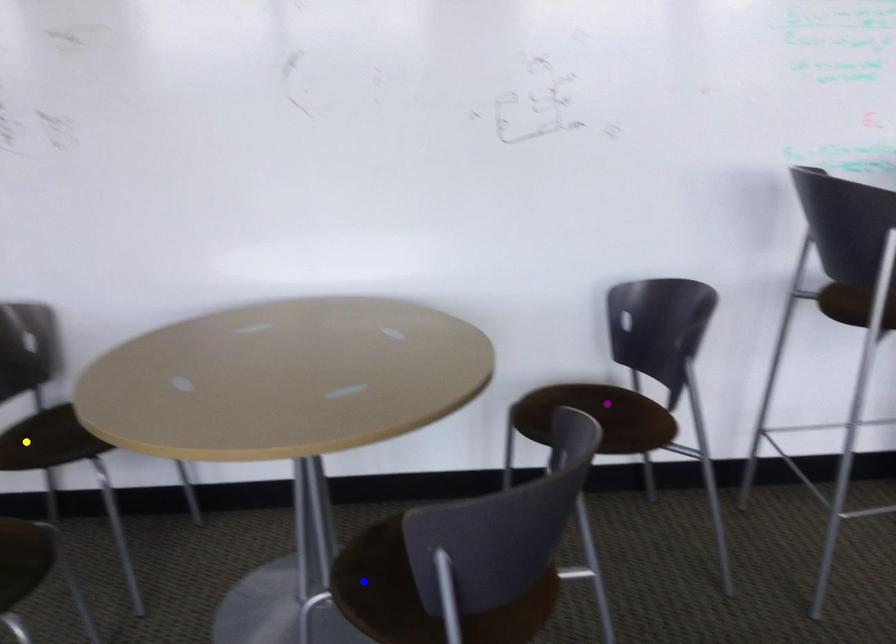
Order these from nearest to farthest:
purple point, yellow point, blue point

1. blue point
2. yellow point
3. purple point